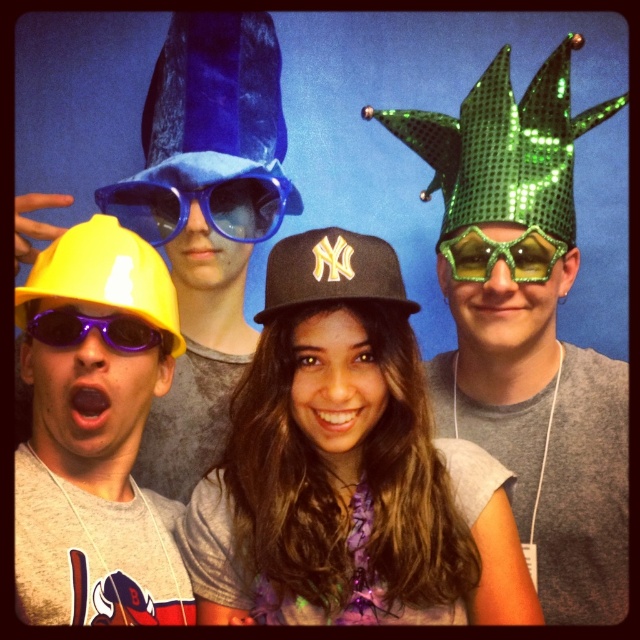
Which is above, matte blue hat at upper left or purple plastic sunglasses at lower left?

matte blue hat at upper left

Is matte blue hat at upper left positioned at the back of purple plastic sunglasses at lower left?

Yes, matte blue hat at upper left is further from the viewer.

Is point (161, 188) farther from viewer compared to point (60, 337)?

Yes, point (161, 188) is farther from viewer.

The height and width of the screenshot is (640, 640). I want to click on matte blue hat at upper left, so click(205, 218).

Is point (38, 598) positioned behind point (99, 330)?

No, it is not.

What do you see at coordinates (97, 433) in the screenshot? The width and height of the screenshot is (640, 640). I see `matte yellow hard hat at left` at bounding box center [97, 433].

Who is more forward, (122, 241) or (44, 328)?

Point (44, 328) is more forward.

Locate an element on the screen. matte yellow hard hat at left is located at coordinates coord(97,433).

Which is below, matte black cap at center or yellow matte baseball cap at left?

matte black cap at center

Is point (259, 522) positioned in front of point (112, 241)?

Yes, it is in front of point (112, 241).

Does point (442, 497) come in front of point (40, 259)?

No.

The image size is (640, 640). I want to click on matte black cap at center, so click(x=346, y=465).